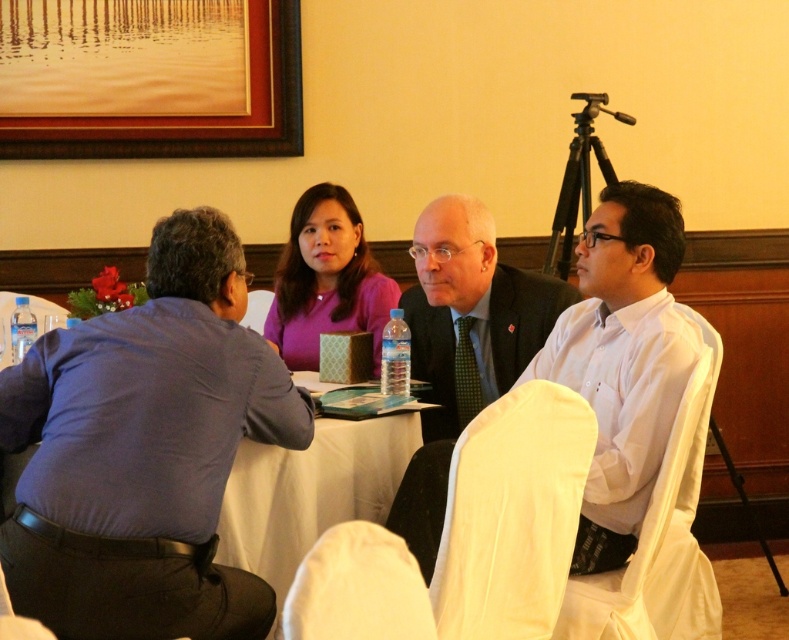
Question: Can you confirm if brown wooden picture frame at upper left is positioned to the left of purple matte shirt at center?

Choices:
 (A) yes
 (B) no

Answer: (A)

Question: Which point is closer to the camera?

Choices:
 (A) 225,100
 (B) 391,310
 (C) 305,209
 (D) 19,317

Answer: (B)

Question: Which object appears farthest from the camera in this image?

Choices:
 (A) brown wooden picture frame at upper left
 (B) dark gray suit at center

Answer: (A)

Question: Which point appears closest to the camera in this image?

Choices:
 (A) (298, 356)
 (B) (384, 380)
 (C) (211, 60)
 (D) (122, 596)

Answer: (D)

Question: Does dark gray suit at center have a lesser width compared to purple matte shirt at center?

Choices:
 (A) yes
 (B) no

Answer: (B)

Question: Is white shirt at center positioned behind clear plastic bottle at center?

Choices:
 (A) no
 (B) yes

Answer: (A)